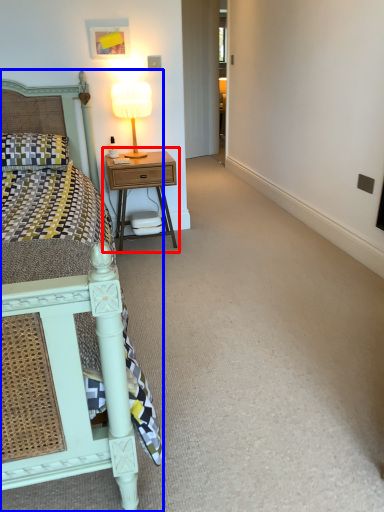
Question: Which object appears farthest to the camera in this image, nightstand (highlighted by a red box) or bed (highlighted by a blue box)?

Choices:
 (A) nightstand
 (B) bed

Answer: (A)